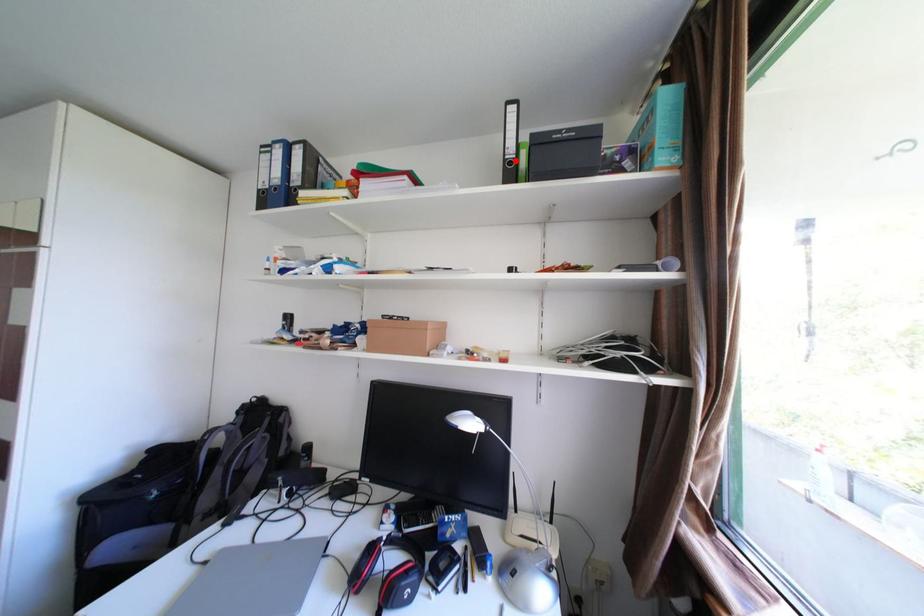
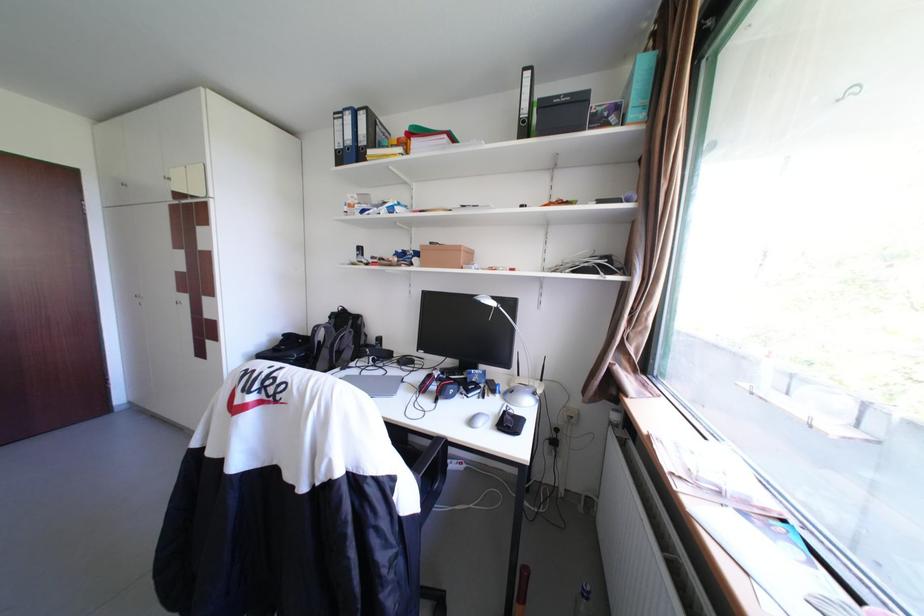
In the second image, find the point that corresponds to the highlighted location in the first image.

(530, 120)